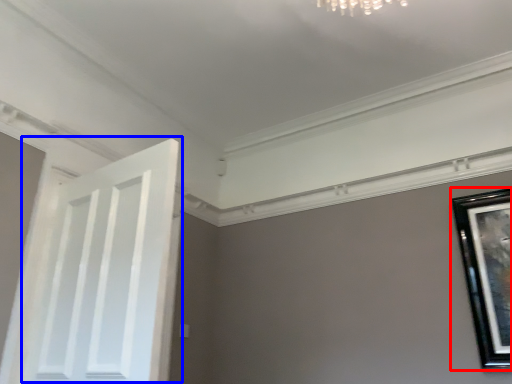
Question: Which object is further to the camera taking this photo, picture frame (highlighted by a red box) or door (highlighted by a blue box)?

Choices:
 (A) picture frame
 (B) door

Answer: (A)